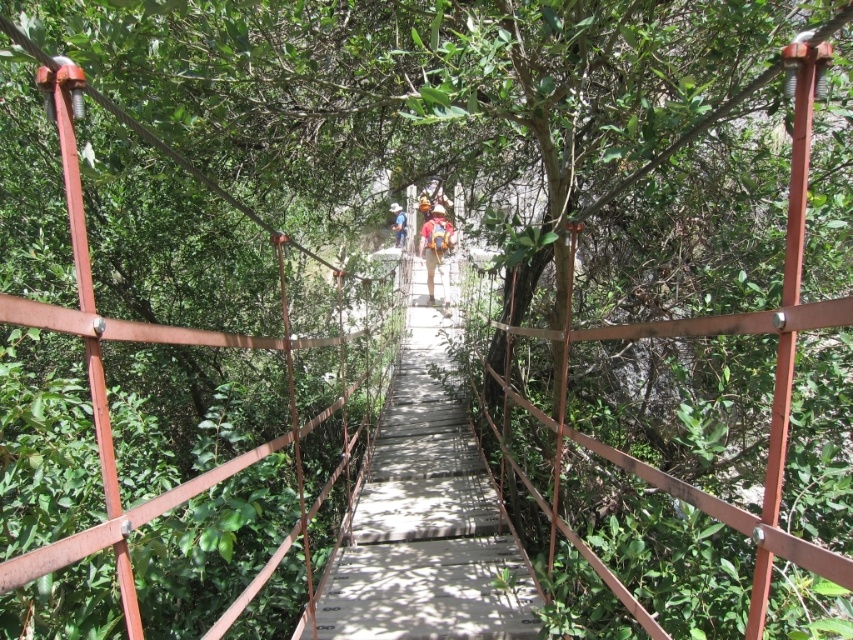
Who is positioned more to the right, wooden bridge at center or camouflage fabric backpack at center?

Positioned to the right is camouflage fabric backpack at center.

Who is higher up, wooden bridge at center or camouflage fabric backpack at center?

Positioned higher is camouflage fabric backpack at center.

Between point (386, 520) and point (431, 259), which one is positioned in front?

Positioned in front is point (386, 520).

Identify the location of wooden bridge at center. The height and width of the screenshot is (640, 853). (427, 516).

Based on the photo, who is more forward, (445, 291) or (396, 234)?

Point (396, 234) is in front.

Can you confirm if camouflage fabric backpack at center is positioned to the right of light blue denim shirt at center?

Indeed, camouflage fabric backpack at center is positioned on the right side of light blue denim shirt at center.

Is point (445, 273) in front of point (389, 208)?

No, it is behind (389, 208).

You are a GUI agent. You are given a task and a screenshot of the screen. Output one action in this format:
    pyautogui.click(x=<x>, y=<y>)
    Task: Click on the camouflage fabric backpack at center
    The width and height of the screenshot is (853, 640).
    Given the screenshot: What is the action you would take?
    pyautogui.click(x=437, y=250)

Who is more distant from viewer, (489, 531) or (395, 234)?

The point (395, 234) is more distant.

Is point (346, 596) closer to camera compared to point (399, 211)?

Yes, it is.

What are the coordinates of `wooden bridge at center` in the screenshot? It's located at (427, 516).